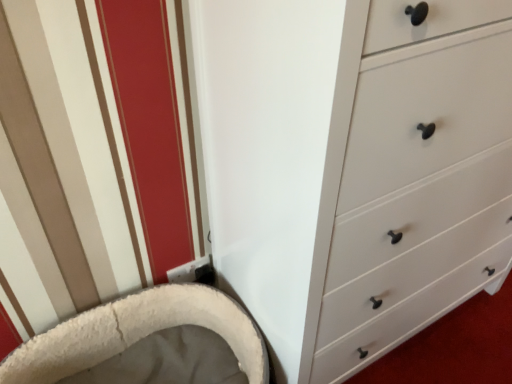
The image size is (512, 384). Identify the location of white fluffy bean bag chair at lower left. (137, 337).

Measure the distance between white fluffy bean bag chair at lower left and camera.

The distance of white fluffy bean bag chair at lower left from camera is 1.09 meters.

This screenshot has width=512, height=384. Describe the element at coordinates (137, 337) in the screenshot. I see `white fluffy bean bag chair at lower left` at that location.

Where is `white fluffy bean bag chair at lower left`? The height and width of the screenshot is (384, 512). white fluffy bean bag chair at lower left is located at coordinates (137, 337).